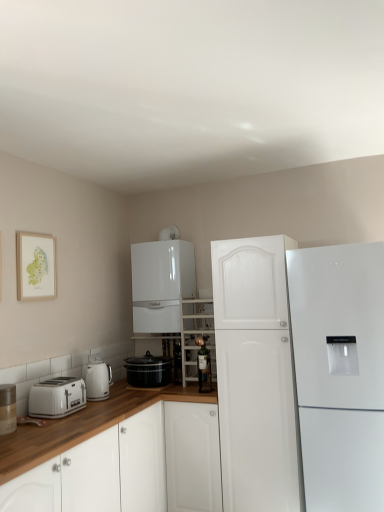
Question: Is white plastic toaster at lower left smaller than white glossy electric kettle at left, the 2th kitchen appliance positioned from the right?

Choices:
 (A) yes
 (B) no

Answer: (B)

Question: From a real-world perspective, does white plastic toaster at lower left stand above white glossy electric kettle at left, acting as the first kitchen appliance starting from the left?

Choices:
 (A) no
 (B) yes

Answer: (A)

Question: Is white glossy electric kettle at left, the 2th kitchen appliance positioned from the right, surrounded by white plastic toaster at lower left?

Choices:
 (A) yes
 (B) no

Answer: (B)

Question: Considering the relative sizes of white plastic toaster at lower left and white glossy electric kettle at left, acting as the first kitchen appliance starting from the left, in the image provided, is white plastic toaster at lower left thinner than white glossy electric kettle at left, acting as the first kitchen appliance starting from the left,?

Choices:
 (A) no
 (B) yes

Answer: (A)

Question: Considering the relative sizes of white plastic toaster at lower left and white glossy electric kettle at left, acting as the first kitchen appliance starting from the left, in the image provided, is white plastic toaster at lower left taller than white glossy electric kettle at left, acting as the first kitchen appliance starting from the left,?

Choices:
 (A) yes
 (B) no

Answer: (B)

Question: Is white plastic toaster at lower left to the right of white glossy electric kettle at left, the 2th kitchen appliance positioned from the right, from the viewer's perspective?

Choices:
 (A) yes
 (B) no

Answer: (B)

Question: Is white plastic toaster at lower left placed right next to matte silver canister at left?

Choices:
 (A) no
 (B) yes

Answer: (A)

Question: From the image's perspective, does white plastic toaster at lower left appear higher than matte silver canister at left?

Choices:
 (A) no
 (B) yes

Answer: (A)

Question: Is white plastic toaster at lower left closer to the viewer compared to matte silver canister at left?

Choices:
 (A) no
 (B) yes

Answer: (A)

Question: From a real-world perspective, is white plastic toaster at lower left below matte silver canister at left?

Choices:
 (A) no
 (B) yes

Answer: (B)

Question: Considering the relative sizes of white plastic toaster at lower left and matte silver canister at left in the image provided, is white plastic toaster at lower left wider than matte silver canister at left?

Choices:
 (A) no
 (B) yes

Answer: (B)

Question: Would you consider white plastic toaster at lower left to be distant from matte silver canister at left?

Choices:
 (A) yes
 (B) no

Answer: (B)

Question: From the image's perspective, would you say white glossy cabinet at lower left is shown under matte glass bottle at center?

Choices:
 (A) no
 (B) yes

Answer: (B)